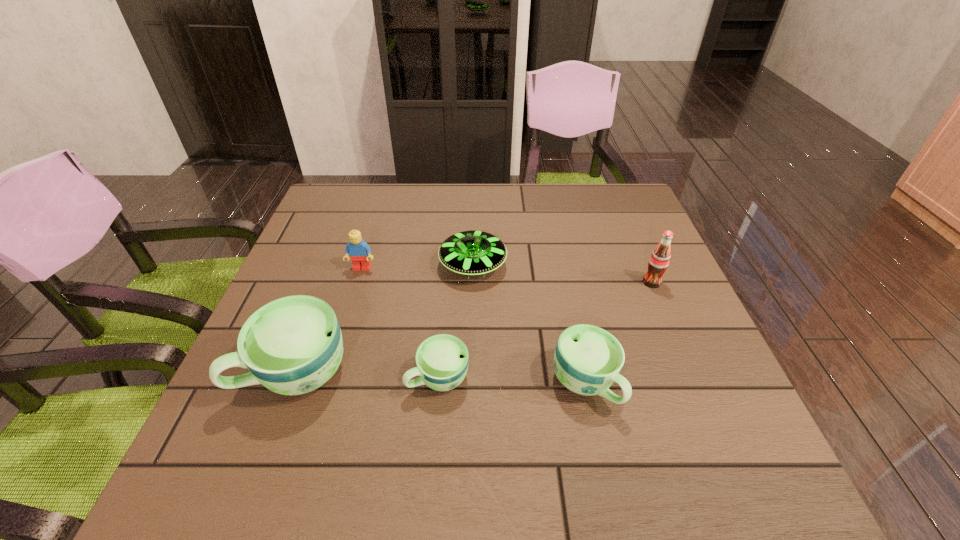
This screenshot has width=960, height=540. Identify the location of vacant space at the right edge. (647, 245).

At what (x,y) coordinates should I click in order to perform the action: click on vacant space at the far left corner of the desktop. Please return your answer as a coordinate pair (x, y). Looking at the image, I should click on (341, 185).

In order to click on vacant space at the near left corner in this screenshot , I will do `click(224, 404)`.

The width and height of the screenshot is (960, 540). In the image, there is a desktop. What are the coordinates of `vacant area at the far right corner` in the screenshot? It's located at (629, 198).

In the image, there is a desktop. In order to click on vacant area at the near right corner in this screenshot , I will do `click(727, 421)`.

Image resolution: width=960 pixels, height=540 pixels. Find the location of `free point between the second shortest cup and the saucer`. free point between the second shortest cup and the saucer is located at coordinates (529, 325).

Locate an element on the screen. This screenshot has height=540, width=960. empty location between the saucer and the Lego is located at coordinates (418, 267).

Locate an element on the screen. This screenshot has height=540, width=960. empty space between the leftmost cup and the rightmost object is located at coordinates (474, 327).

Where is `free space between the shortest cup and the soda`? free space between the shortest cup and the soda is located at coordinates (545, 330).

Identify the location of free spot between the soda and the second cup from left to right. (545, 330).